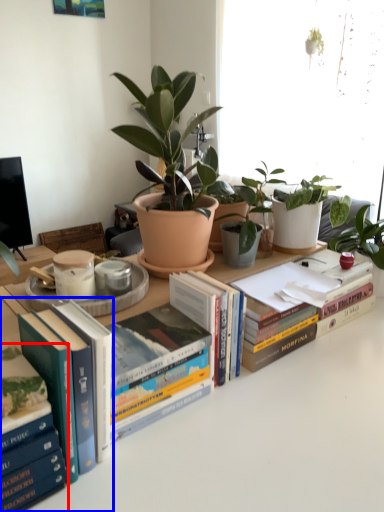
Question: Which object appears farthest to the camera in this image, book (highlighted by a red box) or book (highlighted by a blue box)?

Choices:
 (A) book
 (B) book

Answer: (B)